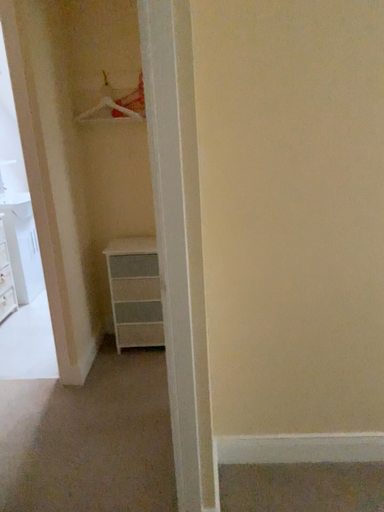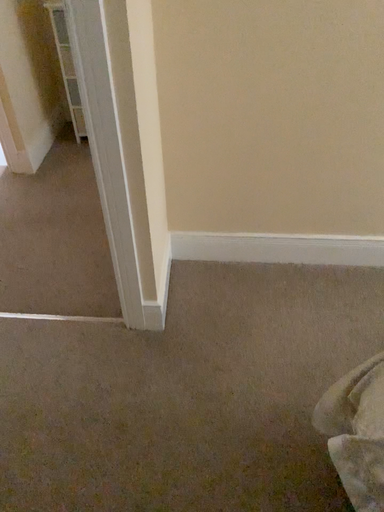
Question: Which way did the camera rotate in the video?

Choices:
 (A) rotated downward
 (B) rotated upward

Answer: (A)